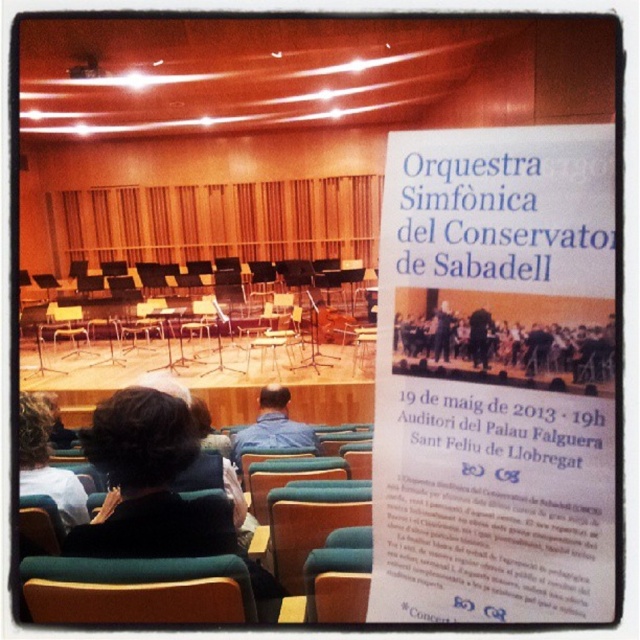
You are sitting in the concert hall and notice a person with dark brown hair at center. Where exactly is this person located in relation to the stage?

The dark brown hair at center is located at point (147, 483), which is in the foreground near the stage.

You are an usher in the concert hall and need to determine if a large poster can be displayed on the stage without blocking the view of the audience. The poster is the size of the white paper at upper center. The blue denim shirt at center is worn by a performer who will stand on the stage. Will the poster obstruct the view of the performer?

The white paper at upper center is much taller than the blue denim shirt at center. Since the poster is the size of the white paper at upper center, it will be taller than the performer wearing the blue denim shirt at center. This means the poster could potentially block the view of the performer, so it should be placed carefully to avoid obstruction.

Based on the photo, you are an usher at the concert hall and need to determine if the white paper at upper center can be placed on top of the blue denim shirt at center without covering it completely. Based on their sizes, what would you advise?

The white paper at upper center is smaller than the blue denim shirt at center, so placing it on top would not cover the shirt completely.